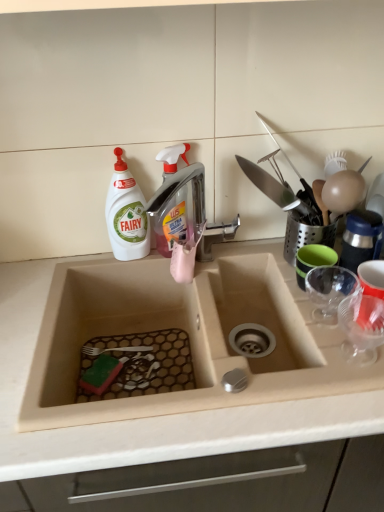
Find the location of a particular element. The width and height of the screenshot is (384, 512). vacant position to the left of transparent plastic cup at right, placed as the 2th tableware when sorted from front to back is located at coordinates click(x=319, y=334).